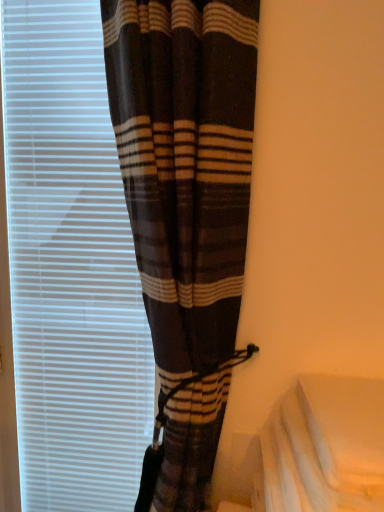
What do you see at coordinates (185, 212) in the screenshot? The width and height of the screenshot is (384, 512). I see `brown plaid curtain at left` at bounding box center [185, 212].

What is the approximate width of white matte window blind at left?

1.55 inches.

This screenshot has height=512, width=384. Identify the location of brown plaid curtain at left. (185, 212).

From the picture: Can you tell me how much white matte window blind at left and brown plaid curtain at left differ in facing direction?

3.84 degrees.

Between white matte window blind at left and brown plaid curtain at left, which one has smaller width?

Thinner between the two is white matte window blind at left.

Which object is positioned more to the left, white matte window blind at left or brown plaid curtain at left?

From the viewer's perspective, white matte window blind at left appears more on the left side.

Image resolution: width=384 pixels, height=512 pixels. What are the coordinates of `curtain that appears on the right of white matte window blind at left` in the screenshot? It's located at (185, 212).

Considering the positions of point (323, 400) and point (145, 125), is point (323, 400) closer or farther from the camera than point (145, 125)?

Point (323, 400) appears to be farther away from the viewer than point (145, 125).

Looking at their sizes, would you say white fabric at lower right is wider or thinner than brown plaid curtain at left?

white fabric at lower right is wider than brown plaid curtain at left.

Can you confirm if white fabric at lower right is shorter than brown plaid curtain at left?

Indeed, white fabric at lower right has a lesser height compared to brown plaid curtain at left.

Considering the positions of objects white fabric at lower right and brown plaid curtain at left in the image provided, who is more to the left, white fabric at lower right or brown plaid curtain at left?

brown plaid curtain at left.

At what (x,y) coordinates should I click in order to perform the action: click on curtain below the white matte window blind at left (from the image's perspective). Please return your answer as a coordinate pair (x, y). Image resolution: width=384 pixels, height=512 pixels. Looking at the image, I should click on (185, 212).

Can you confirm if brown plaid curtain at left is bigger than white matte window blind at left?

Yes.

Which is in front, brown plaid curtain at left or white matte window blind at left?

brown plaid curtain at left is in front.

Would you say brown plaid curtain at left is a long distance from white matte window blind at left?

No, there isn't a large distance between brown plaid curtain at left and white matte window blind at left.

Is point (49, 56) behind point (372, 495)?

Yes, it is.

Is white matte window blind at left turned away from white fabric at lower right?

No, white matte window blind at left's orientation is not away from white fabric at lower right.

Is white matte window blind at left inside the boundaries of white fabric at lower right, or outside?

The correct answer is: outside.

Between white matte window blind at left and white fabric at lower right, which one has more height?

Standing taller between the two is white matte window blind at left.

Is brown plaid curtain at left facing towards white fabric at lower right?

No, brown plaid curtain at left is not turned towards white fabric at lower right.

Between brown plaid curtain at left and white fabric at lower right, which one has larger width?

white fabric at lower right is wider.

Is brown plaid curtain at left bigger than white fabric at lower right?

Correct, brown plaid curtain at left is larger in size than white fabric at lower right.

Is white fabric at lower right oriented away from white matte window blind at left?

white fabric at lower right does not have its back to white matte window blind at left.

Is white fabric at lower right to the left of white matte window blind at left from the viewer's perspective?

In fact, white fabric at lower right is to the right of white matte window blind at left.

I want to click on sheet below the white matte window blind at left (from the image's perspective), so click(x=327, y=446).

Does white fabric at lower right have a smaller size compared to white matte window blind at left?

Correct, white fabric at lower right occupies less space than white matte window blind at left.

At what (x,y) coordinates should I click in order to perform the action: click on curtain on the right side of white matte window blind at left. Please return your answer as a coordinate pair (x, y). This screenshot has height=512, width=384. Looking at the image, I should click on (185, 212).

Where is `sheet behind the brown plaid curtain at left`? This screenshot has height=512, width=384. sheet behind the brown plaid curtain at left is located at coordinates (327, 446).

Which object lies further to the anchor point white matte window blind at left, white fabric at lower right or brown plaid curtain at left?

Based on the image, white fabric at lower right appears to be further to white matte window blind at left.

From the picture: Based on their spatial positions, is white matte window blind at left or brown plaid curtain at left closer to white fabric at lower right?

Based on the image, brown plaid curtain at left appears to be nearer to white fabric at lower right.

From the picture: From the image, which object appears to be nearer to white matte window blind at left, brown plaid curtain at left or white fabric at lower right?

The object closer to white matte window blind at left is brown plaid curtain at left.

Which object lies nearer to the anchor point white fabric at lower right, brown plaid curtain at left or white matte window blind at left?

brown plaid curtain at left is positioned closer to the anchor white fabric at lower right.

Looking at the image, which one is located closer to brown plaid curtain at left, white matte window blind at left or white fabric at lower right?

white matte window blind at left lies closer to brown plaid curtain at left than the other object.

Considering their positions, is white fabric at lower right positioned further to brown plaid curtain at left than white matte window blind at left?

white fabric at lower right lies further to brown plaid curtain at left than the other object.

The image size is (384, 512). I want to click on curtain situated between white matte window blind at left and white fabric at lower right from left to right, so click(x=185, y=212).